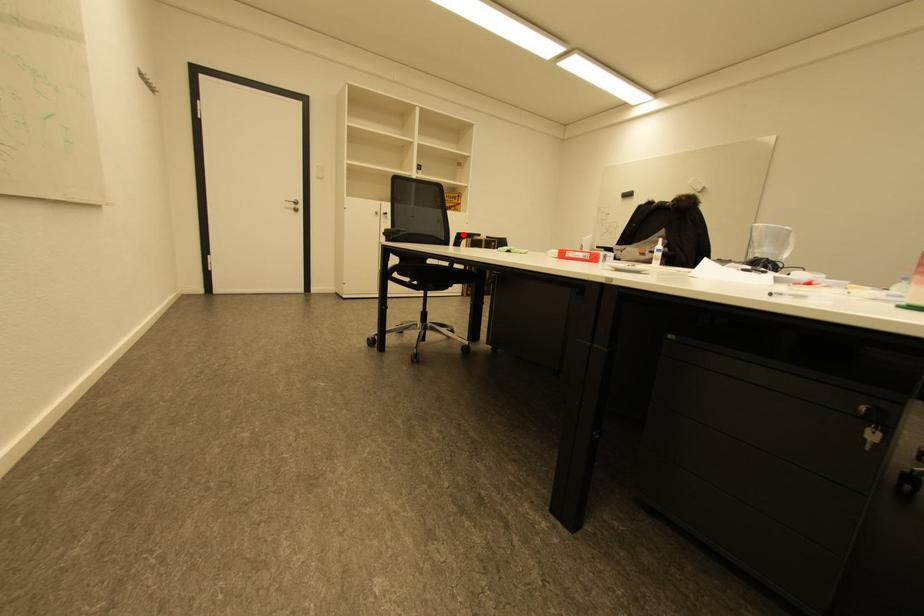
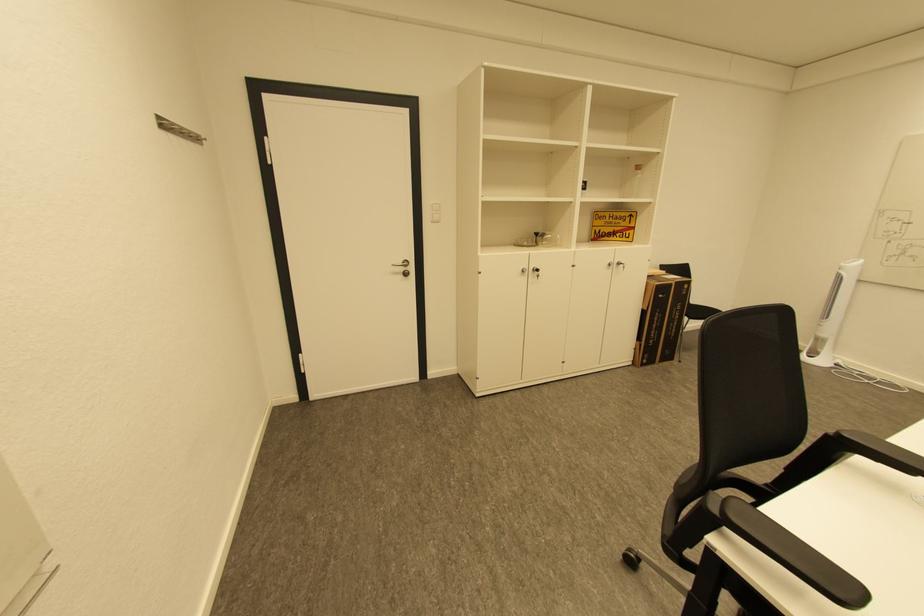
Locate, in the second image, the point that corresponds to the highlighted location in the first image.

(845, 436)